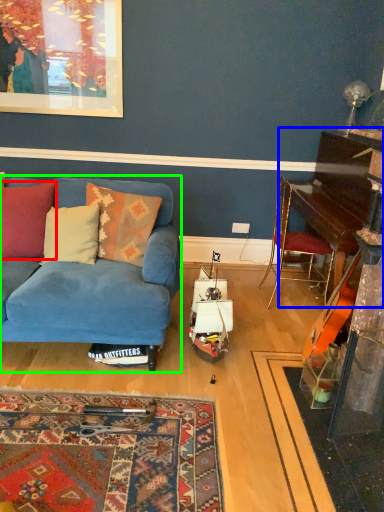
Question: Considering the real-world distances, which object is farthest from pillow (highlighted by a red box)? piano (highlighted by a blue box) or studio couch (highlighted by a green box)?

Choices:
 (A) piano
 (B) studio couch

Answer: (A)